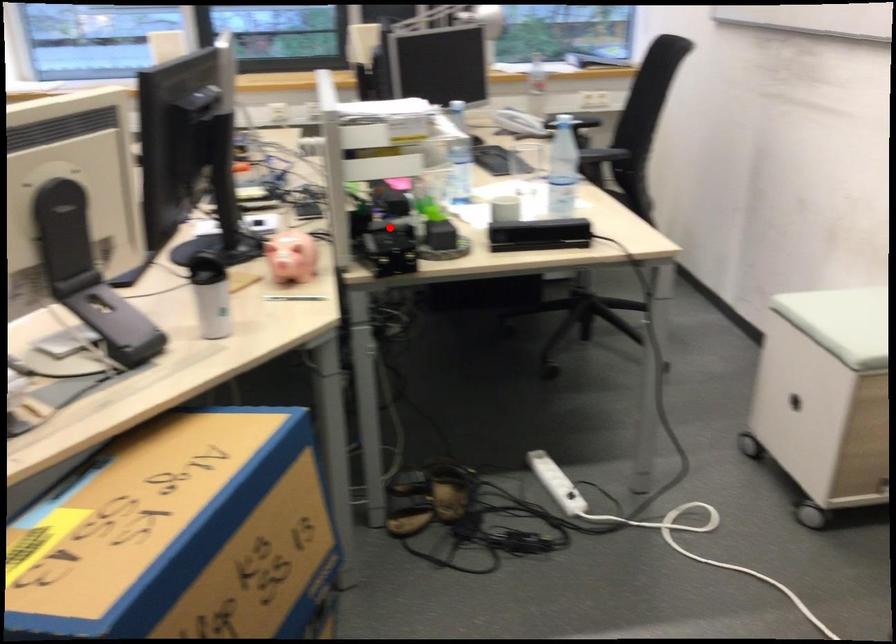
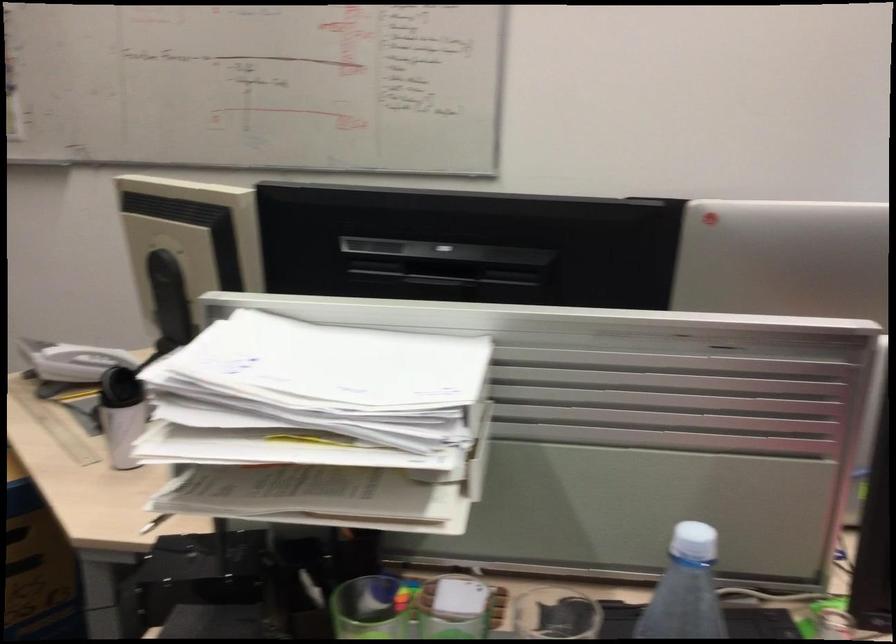
Question: I am providing you with two images of the same scene from different viewpoints. In image1, a red point is highlighted. Considering the same 3D point in image2, which of the following is correct?

Choices:
 (A) It is closer
 (B) It is farther

Answer: (A)